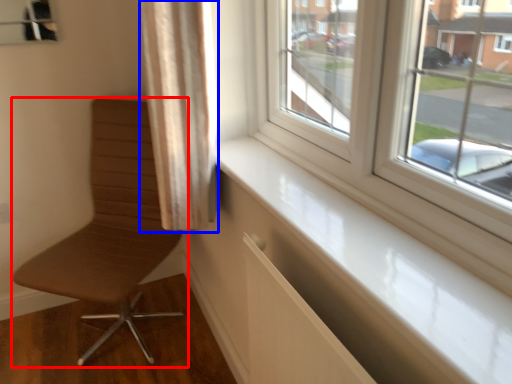
Question: Among these objects, which one is farthest to the camera, chair (highlighted by a red box) or curtain (highlighted by a blue box)?

Choices:
 (A) chair
 (B) curtain

Answer: (A)